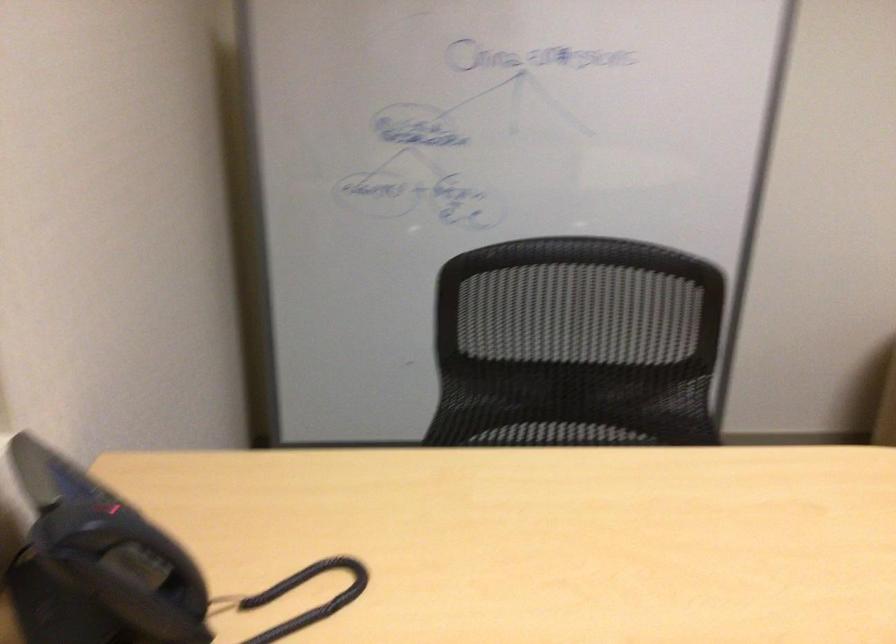
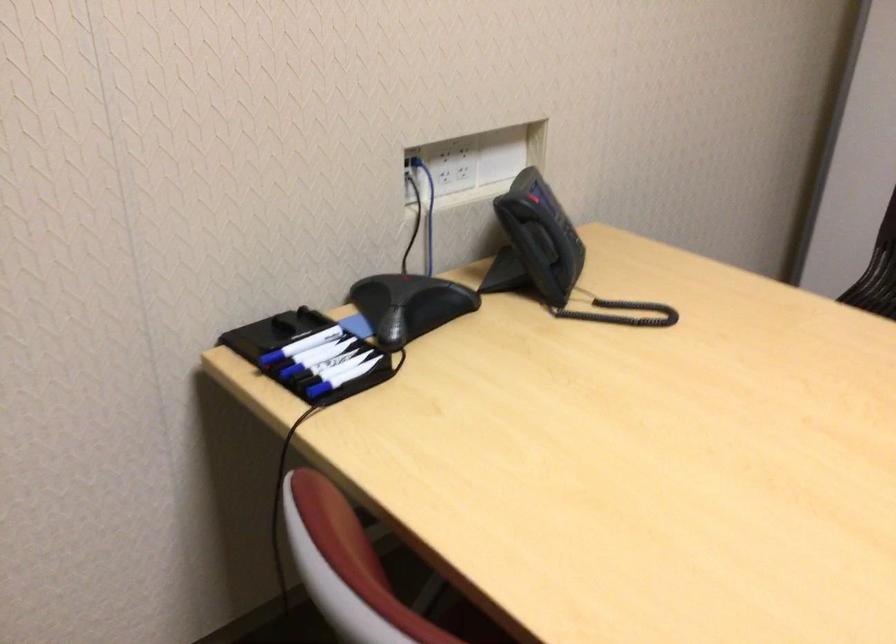
Find the pixel in the second image that matches the point at 97,515 in the first image.

(530, 202)